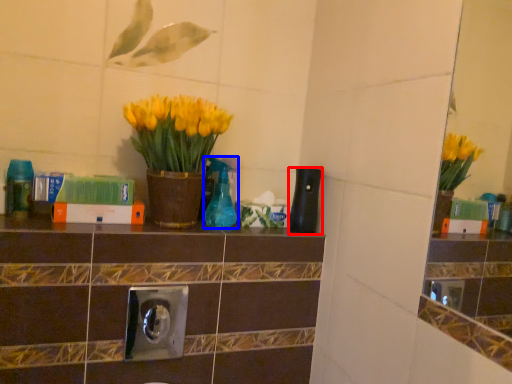
Question: Which object appears farthest to the camera in this image, bottle (highlighted by a red box) or bottle (highlighted by a blue box)?

Choices:
 (A) bottle
 (B) bottle

Answer: (A)